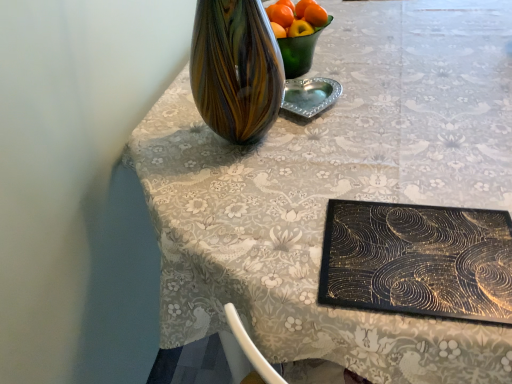
Where is `vacant area that lies to the right of silver metallic heart-shaped tray at center`? vacant area that lies to the right of silver metallic heart-shaped tray at center is located at coordinates (379, 92).